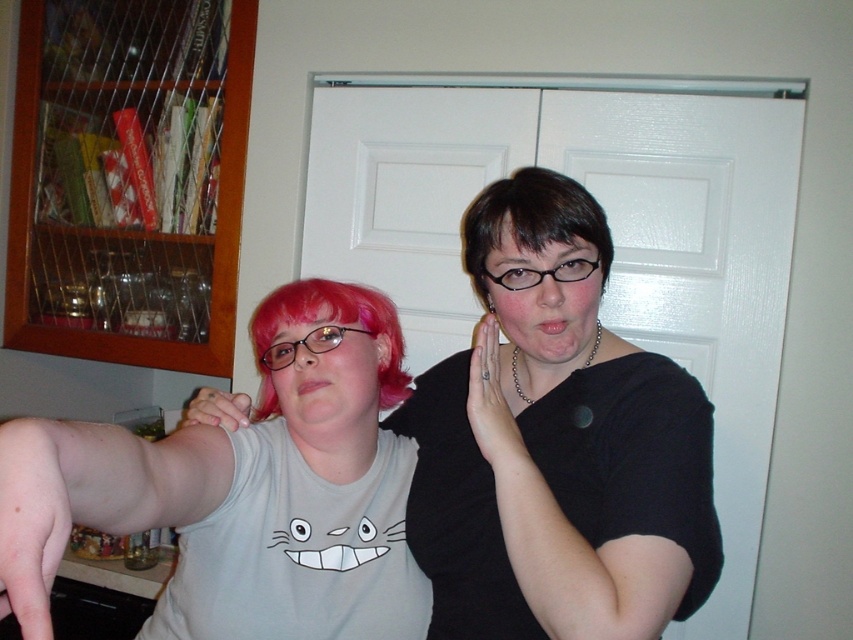
Question: Does black matte shirt at center have a lesser width compared to light gray cotton tank top at center?

Choices:
 (A) yes
 (B) no

Answer: (A)

Question: Which of these objects is positioned closest to the pale flesh muscle at lower left?

Choices:
 (A) black matte shirt at center
 (B) light gray cotton tank top at center
 (C) pink synthetic wig at center

Answer: (B)

Question: Does light gray cotton tank top at center appear on the right side of pink synthetic wig at center?

Choices:
 (A) no
 (B) yes

Answer: (A)

Question: Is black matte shirt at center smaller than pale flesh muscle at lower left?

Choices:
 (A) no
 (B) yes

Answer: (A)

Question: Among these points, which one is farthest from the camera?

Choices:
 (A) [x=553, y=228]
 (B) [x=558, y=451]

Answer: (B)

Question: Among these points, which one is farthest from the camera?

Choices:
 (A) (405, 540)
 (B) (337, 348)
 (C) (396, 358)

Answer: (C)